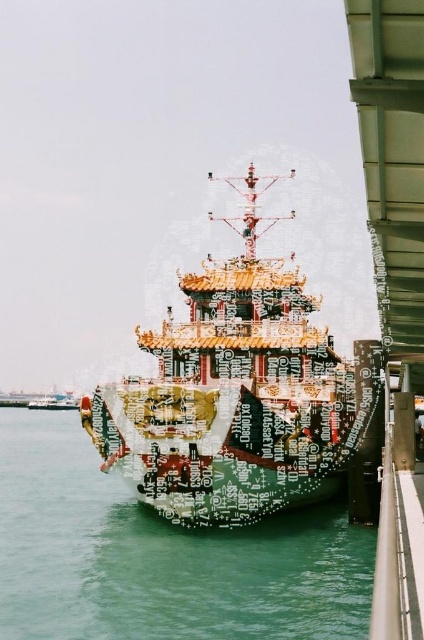
You are standing at point [183,600] on the ship. The ship is 96.62 meters long from bow to stern. Can you walk from the bow to the stern without leaving the ship?

The distance between the bow and the stern is 96.62 meters, so yes, you can walk from the bow to the stern without leaving the ship since the ship is long enough to accommodate the journey.

You are standing on the pier next to the ship and want to throw a small floating toy into the green glossy water at center. Based on the coordinates provided, where should you aim relative to your position?

The green glossy water at center is located at coordinates point (159, 556), so you should aim towards that specific coordinate point to ensure the toy lands in the green glossy water at center.